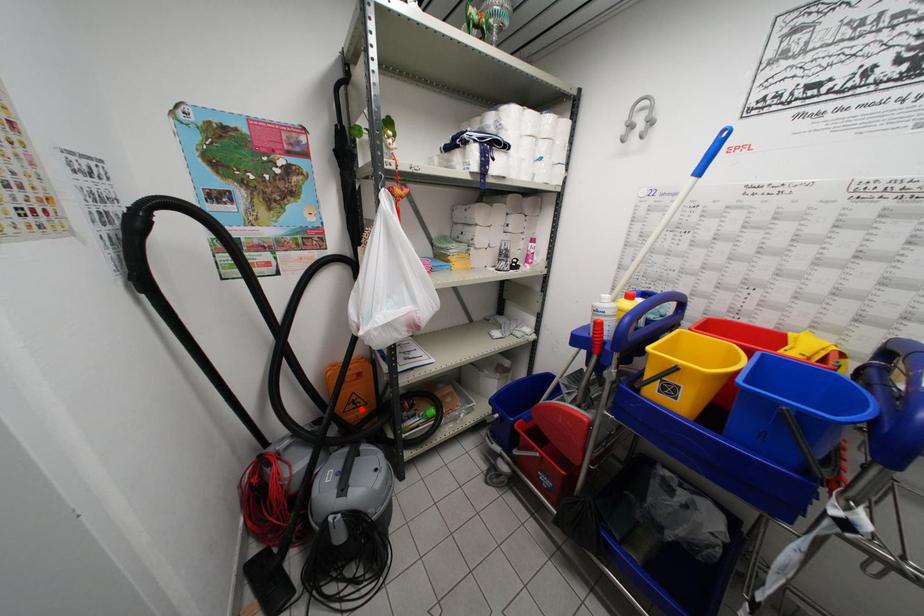
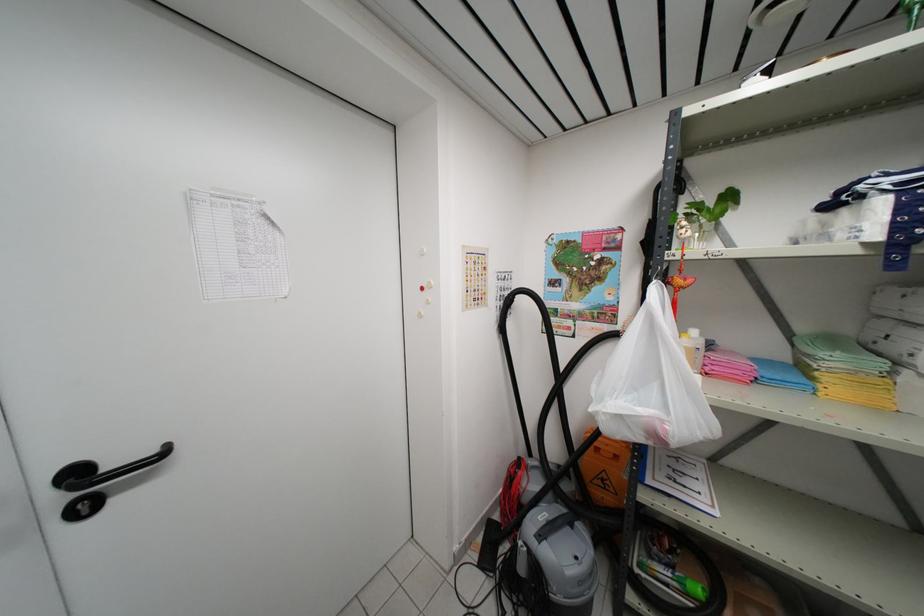
Find the pixel in the second image that matches the highlighted location in the first image.

(610, 492)